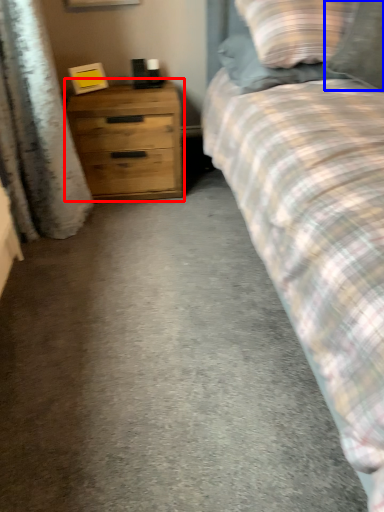
Question: Which object appears closest to the camera in this image, chest of drawers (highlighted by a red box) or pillow (highlighted by a blue box)?

Choices:
 (A) chest of drawers
 (B) pillow

Answer: (B)